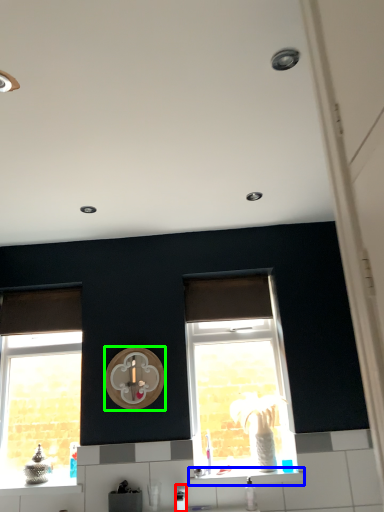
Question: Which object is the closest to the appliance (highlighted by a red box)? Choose among these: window sill (highlighted by a blue box) or clock (highlighted by a green box).

Choices:
 (A) window sill
 (B) clock

Answer: (A)